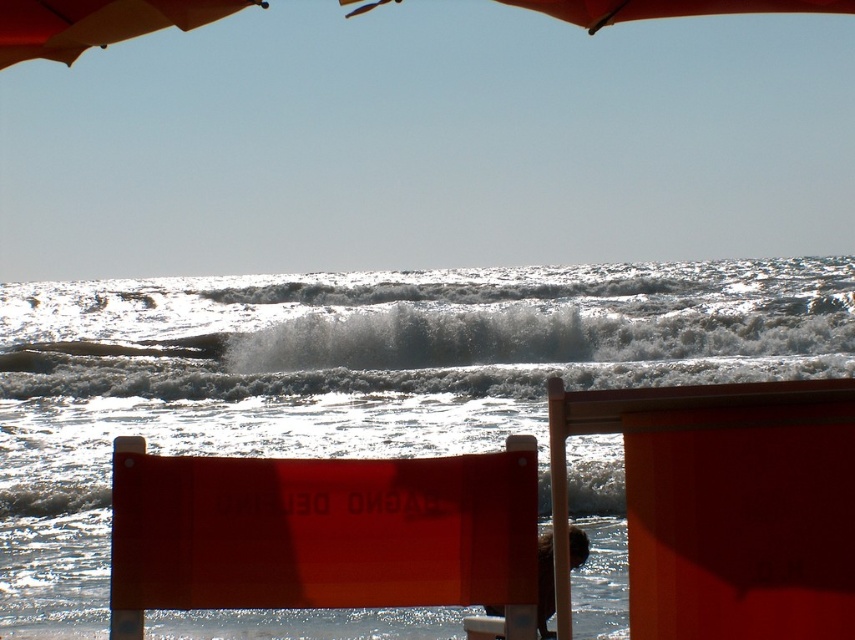
You are a photographer trying to capture the white frothy wave at center and the orange fabric umbrella at upper center in the same frame. Based on their positions, which object is positioned more to the right side of the image?

→ The white frothy wave at center is positioned more to the right side of the image than the orange fabric umbrella at upper center.